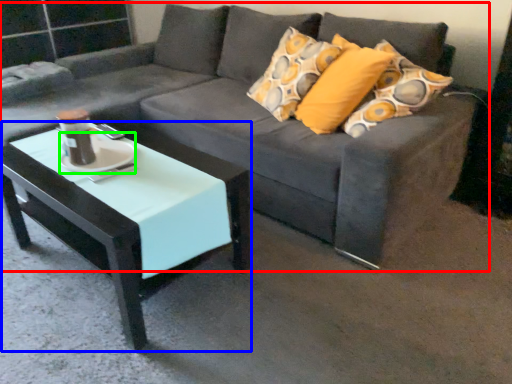
Question: Which is nearer to the studio couch (highlighted by a red box)? coffee table (highlighted by a blue box) or saucer (highlighted by a green box).

Choices:
 (A) coffee table
 (B) saucer

Answer: (A)